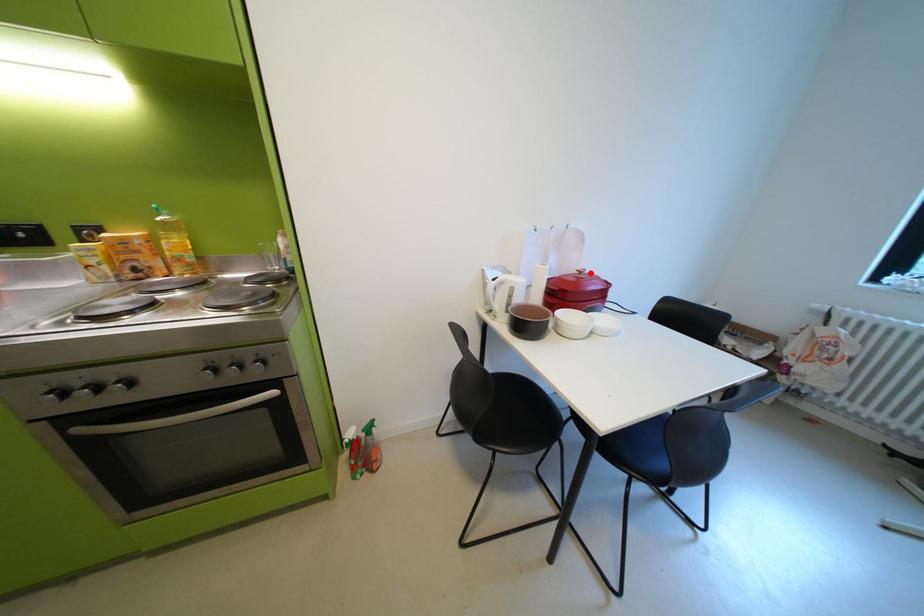
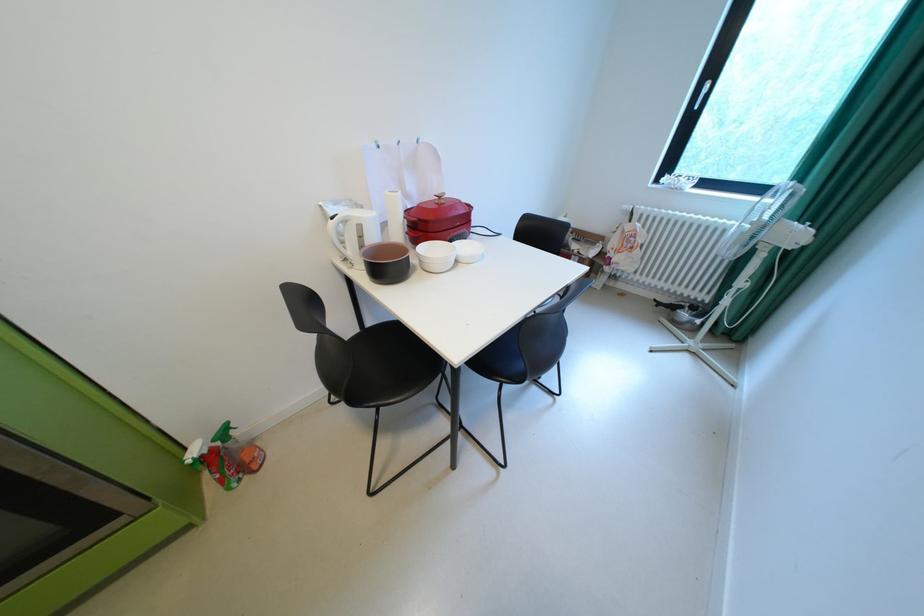
Where in the second image is the point corresponding to the highlighted location from the first image?

(450, 198)